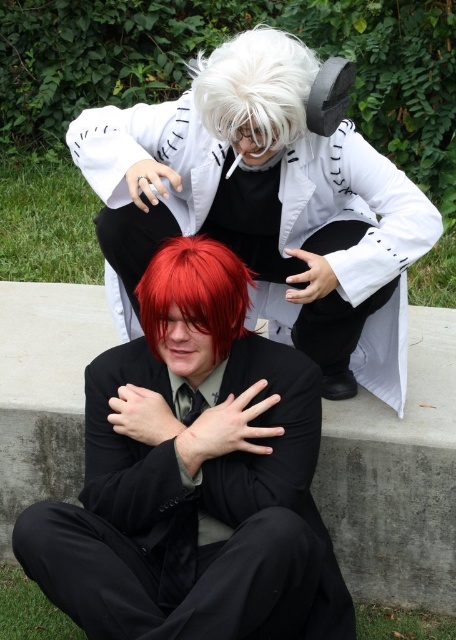
Question: From the image, what is the correct spatial relationship of white matte coat at upper center in relation to white fluffy wig at upper center?

Choices:
 (A) above
 (B) below

Answer: (B)

Question: Which object is the farthest from the white matte coat at upper center?

Choices:
 (A) shiny red wig at center
 (B) white fluffy wig at upper center
 (C) shiny black suit at center

Answer: (C)

Question: Among these points, which one is nearest to the camera?

Choices:
 (A) (283, 122)
 (B) (327, 276)
 (C) (124, 516)
 (D) (159, 268)

Answer: (A)

Question: Considering the real-world distances, which object is closest to the shiny red wig at center?

Choices:
 (A) white fluffy wig at upper center
 (B) shiny black suit at center

Answer: (B)

Question: Where is shiny black suit at center located in relation to white fluffy wig at upper center in the image?

Choices:
 (A) below
 (B) above

Answer: (A)

Question: Does white fluffy wig at upper center have a lesser width compared to shiny red wig at center?

Choices:
 (A) no
 (B) yes

Answer: (B)